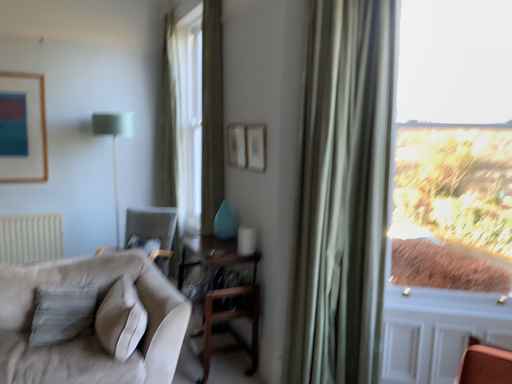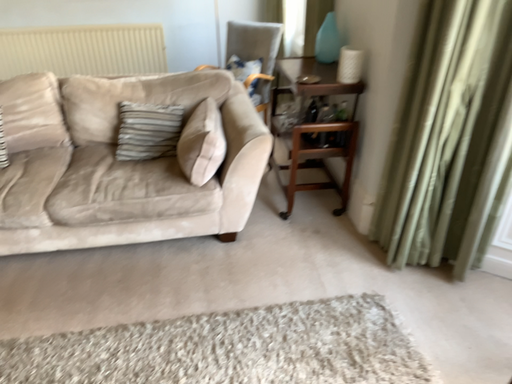
Question: Which way did the camera rotate in the video?

Choices:
 (A) rotated right
 (B) rotated left

Answer: (B)